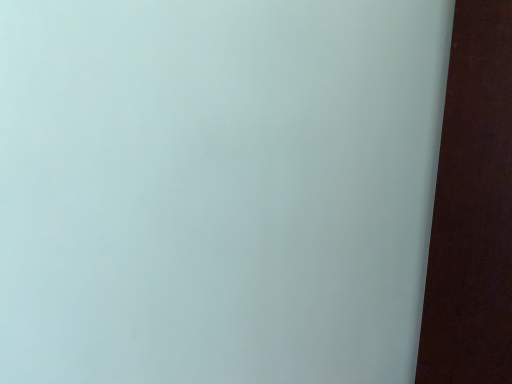
Question: Should I look upward or downward to see matte brown plank at right?

Choices:
 (A) up
 (B) down

Answer: (B)